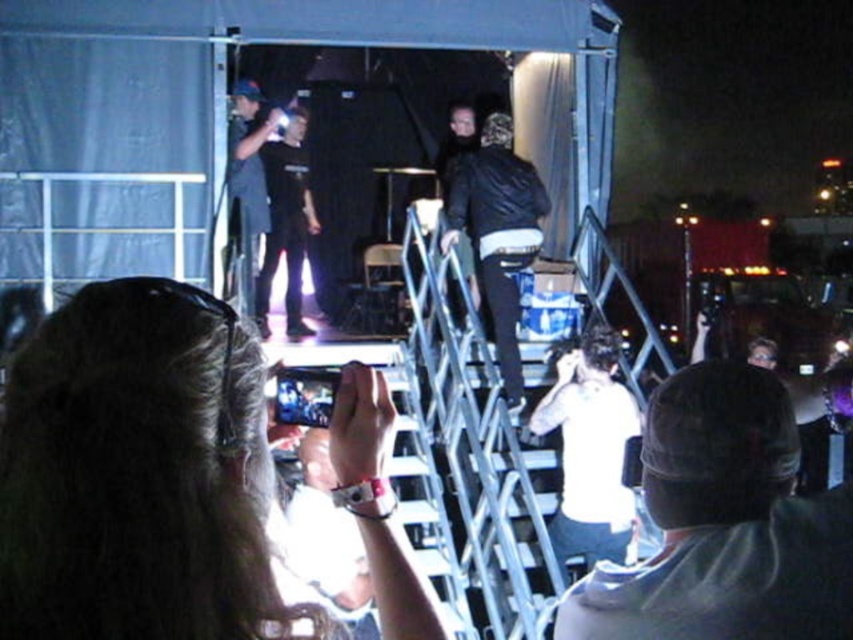
Who is higher up, silver metallic ladder at center or dark blue jeans at upper center?

Positioned higher is dark blue jeans at upper center.

Who is more distant from viewer, (451, 355) or (235, 104)?

The point (235, 104) is behind.

Image resolution: width=853 pixels, height=640 pixels. Identify the location of silver metallic ladder at center. (479, 445).

What do you see at coordinates (479, 445) in the screenshot? The height and width of the screenshot is (640, 853). I see `silver metallic ladder at center` at bounding box center [479, 445].

Is point (486, 388) positioned before point (612, 528)?

No.

You are a GUI agent. You are given a task and a screenshot of the screen. Output one action in this format:
    pyautogui.click(x=<x>, y=<y>)
    Task: Click on the silver metallic ladder at center
    This screenshot has height=640, width=853.
    Given the screenshot: What is the action you would take?
    pyautogui.click(x=479, y=445)

Does gray fabric cap at upper right appear over dark blue jeans at upper center?

No, gray fabric cap at upper right is not above dark blue jeans at upper center.

Can you confirm if gray fabric cap at upper right is smaller than dark blue jeans at upper center?

Yes.

This screenshot has height=640, width=853. I want to click on gray fabric cap at upper right, so click(724, 524).